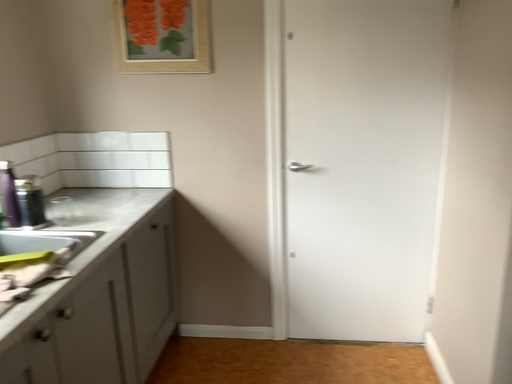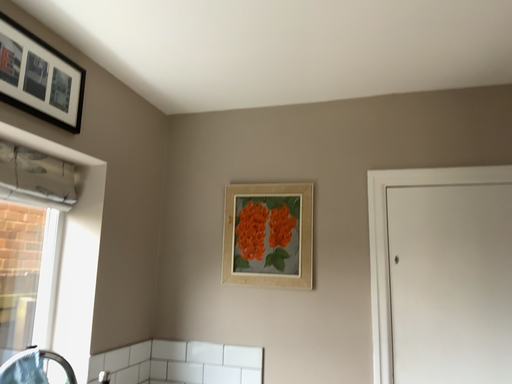
Question: Which way did the camera rotate in the video?

Choices:
 (A) rotated left
 (B) rotated right

Answer: (A)